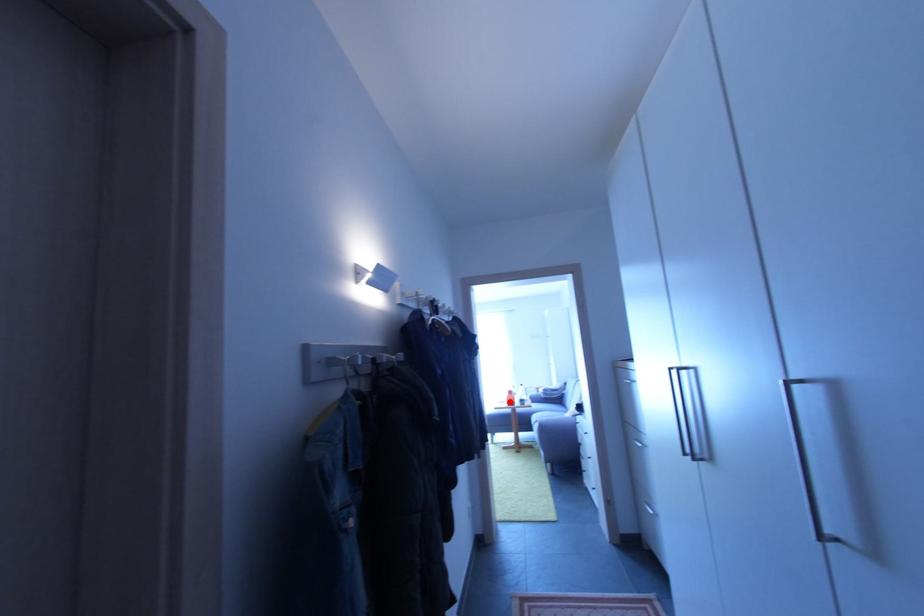
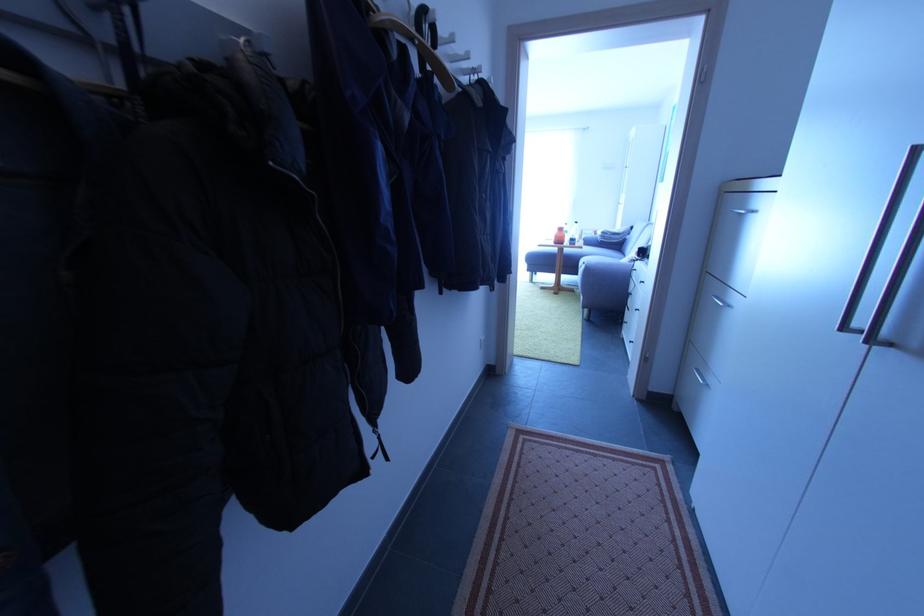
Find the pixel in the second image that matches the highlighted location in the first image.

(557, 238)